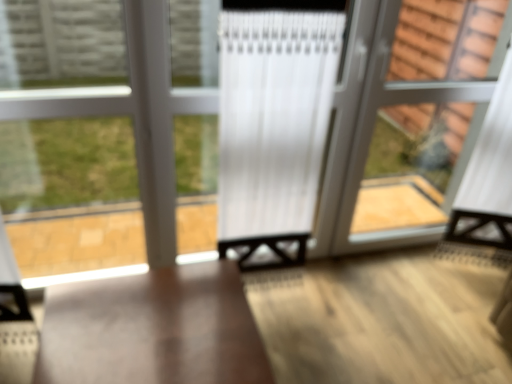
What do you see at coordinates (152, 329) in the screenshot?
I see `matte wood table at center` at bounding box center [152, 329].

The image size is (512, 384). What do you see at coordinates (66, 164) in the screenshot?
I see `clear glass bay window at left` at bounding box center [66, 164].

Locate an element on the screen. The height and width of the screenshot is (384, 512). clear glass screen door at right is located at coordinates (419, 119).

Can we say clear glass screen door at right lies outside clear glass bay window at left?

Indeed, clear glass screen door at right is completely outside clear glass bay window at left.

Considering the relative sizes of clear glass screen door at right and clear glass bay window at left in the image provided, is clear glass screen door at right smaller than clear glass bay window at left?

No.

Does point (424, 151) appear closer or farther from the camera than point (178, 147)?

Point (424, 151) is positioned farther from the camera compared to point (178, 147).

How distant is clear glass bay window at left from matte wood table at center?

clear glass bay window at left is 82.20 centimeters from matte wood table at center.

Is clear glass bay window at left facing away from matte wood table at center?

clear glass bay window at left does not have its back to matte wood table at center.

The height and width of the screenshot is (384, 512). Find the location of `bay window on the left of matte wood table at center`. bay window on the left of matte wood table at center is located at coordinates (66, 164).

How different are the orientations of clear glass bay window at left and matte wood table at center in degrees?

2.27 degrees separate the facing orientations of clear glass bay window at left and matte wood table at center.

Which object is closer to the camera, matte wood table at center or clear glass bay window at left?

Positioned in front is matte wood table at center.

Where is `bay window located on the left of matte wood table at center`? The width and height of the screenshot is (512, 384). bay window located on the left of matte wood table at center is located at coordinates (66, 164).

Is clear glass bay window at left completely or partially inside matte wood table at center?

No.

In the scene shown: Is matte wood table at center to the left or to the right of clear glass bay window at left in the image?

matte wood table at center is positioned on clear glass bay window at left's right side.

Considering the sizes of objects clear glass screen door at right and matte wood table at center in the image provided, who is smaller, clear glass screen door at right or matte wood table at center?

Smaller between the two is clear glass screen door at right.

Is clear glass screen door at right oriented away from matte wood table at center?

clear glass screen door at right does not have its back to matte wood table at center.

How far apart are clear glass screen door at right and matte wood table at center?

clear glass screen door at right is 1.21 meters from matte wood table at center.

From the image's perspective, is clear glass screen door at right located above matte wood table at center?

Yes, from the image's perspective, clear glass screen door at right is over matte wood table at center.

Could you tell me if matte wood table at center is facing clear glass screen door at right?

No, matte wood table at center is not facing towards clear glass screen door at right.

How different are the orientations of matte wood table at center and clear glass screen door at right in degrees?

There is a 0.507-degree angle between the facing directions of matte wood table at center and clear glass screen door at right.

From a real-world perspective, relative to clear glass screen door at right, is matte wood table at center vertically above or below?

matte wood table at center is situated lower than clear glass screen door at right in the real world.

Find the location of a particular element. furniture in front of the clear glass screen door at right is located at coordinates (152, 329).

Consider the image. Which of these two, clear glass bay window at left or clear glass screen door at right, stands shorter?

Standing shorter between the two is clear glass bay window at left.

Is clear glass bay window at left not close to clear glass screen door at right?

Yes, clear glass bay window at left and clear glass screen door at right are located far from each other.

In terms of size, does clear glass bay window at left appear bigger or smaller than clear glass screen door at right?

clear glass bay window at left is smaller than clear glass screen door at right.

From a real-world perspective, between clear glass bay window at left and clear glass screen door at right, who is vertically lower?

clear glass bay window at left.

The height and width of the screenshot is (384, 512). In order to click on bay window that is below the clear glass screen door at right (from the image's perspective) in this screenshot , I will do `click(66, 164)`.

This screenshot has height=384, width=512. I want to click on furniture below the clear glass bay window at left (from a real-world perspective), so click(152, 329).

Which object lies further to the anchor point clear glass screen door at right, clear glass bay window at left or matte wood table at center?

matte wood table at center is further to clear glass screen door at right.

Looking at the image, which one is located closer to clear glass bay window at left, matte wood table at center or clear glass screen door at right?

The object closer to clear glass bay window at left is matte wood table at center.

Looking at the image, which one is located further to clear glass bay window at left, clear glass screen door at right or matte wood table at center?

The object further to clear glass bay window at left is clear glass screen door at right.

Looking at the image, which one is located closer to clear glass screen door at right, matte wood table at center or clear glass bay window at left?

Among the two, clear glass bay window at left is located nearer to clear glass screen door at right.

In the scene shown: When comparing their distances from matte wood table at center, does clear glass bay window at left or clear glass screen door at right seem closer?

clear glass bay window at left lies closer to matte wood table at center than the other object.

Based on their spatial positions, is clear glass screen door at right or clear glass bay window at left closer to matte wood table at center?

The object closer to matte wood table at center is clear glass bay window at left.

Where is `furniture situated between clear glass bay window at left and clear glass screen door at right from left to right`? The height and width of the screenshot is (384, 512). furniture situated between clear glass bay window at left and clear glass screen door at right from left to right is located at coordinates (152, 329).